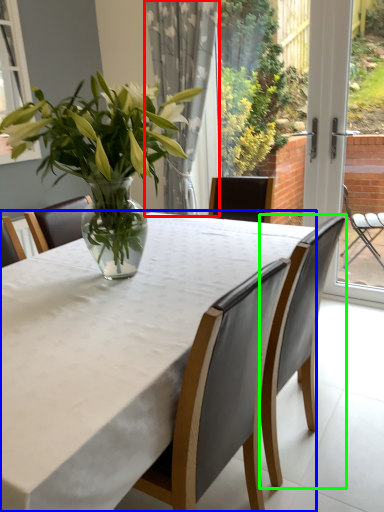
Question: Which is farther away from curtain (highlighted by a red box)? table (highlighted by a blue box) or chair (highlighted by a green box)?

Choices:
 (A) table
 (B) chair

Answer: (A)